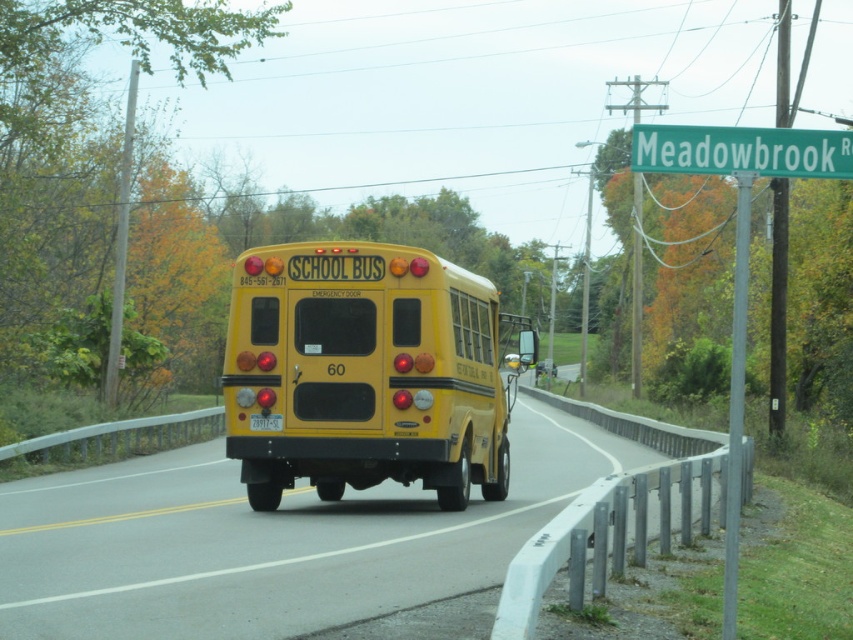
Is yellow matte/solid school bus at center above gray metallic pole at right?

No, yellow matte/solid school bus at center is not above gray metallic pole at right.

Is point (308, 260) closer to camera compared to point (741, 356)?

That is False.

Is point (422, 284) in front of point (741, 240)?

No, it is not.

This screenshot has height=640, width=853. Find the location of `yellow matte/solid school bus at center`. yellow matte/solid school bus at center is located at coordinates (364, 372).

Is green plastic street sign at upper center wider than green plastic signpost at upper right?

No.

Between point (827, 150) and point (776, 372), which one is positioned in front?

Point (827, 150)

At what (x,y) coordinates should I click in order to perform the action: click on green plastic street sign at upper center. Please return your answer as a coordinate pair (x, y). The width and height of the screenshot is (853, 640). Looking at the image, I should click on (741, 150).

Which of these two, gray metallic pole at right or green plastic signpost at upper right, stands taller?

Standing taller between the two is green plastic signpost at upper right.

Is point (746, 259) in front of point (776, 188)?

Yes.

Image resolution: width=853 pixels, height=640 pixels. Identify the location of gray metallic pole at right. (735, 403).